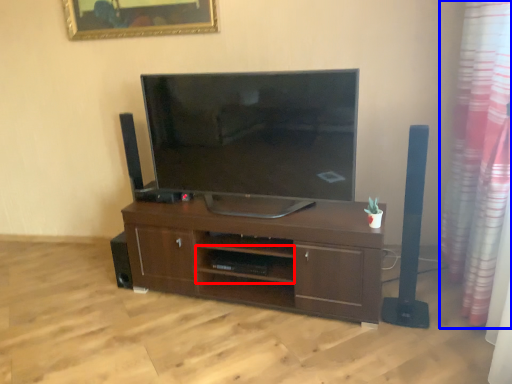
Question: Which point is further to the camera, shelf (highlighted by a red box) or curtain (highlighted by a blue box)?

Choices:
 (A) shelf
 (B) curtain

Answer: (A)